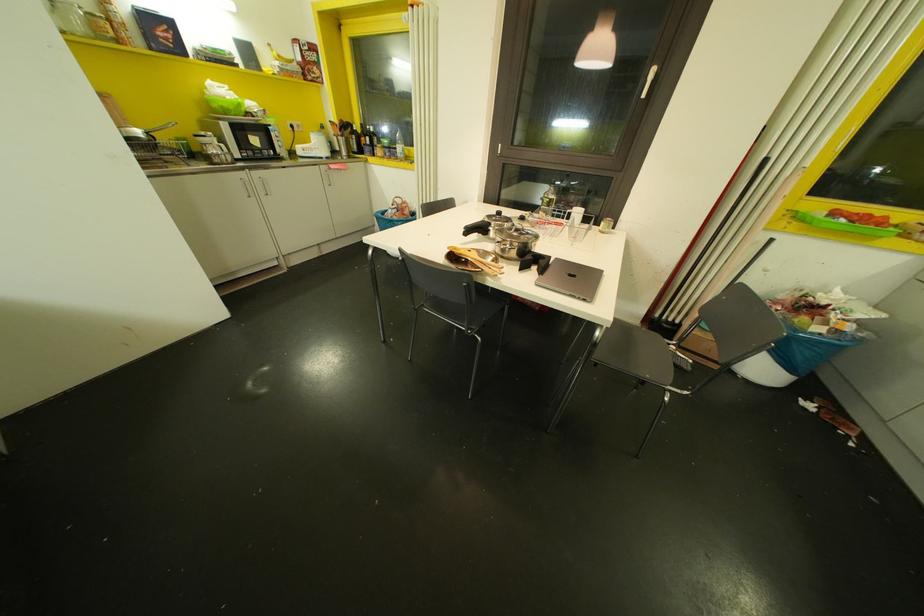
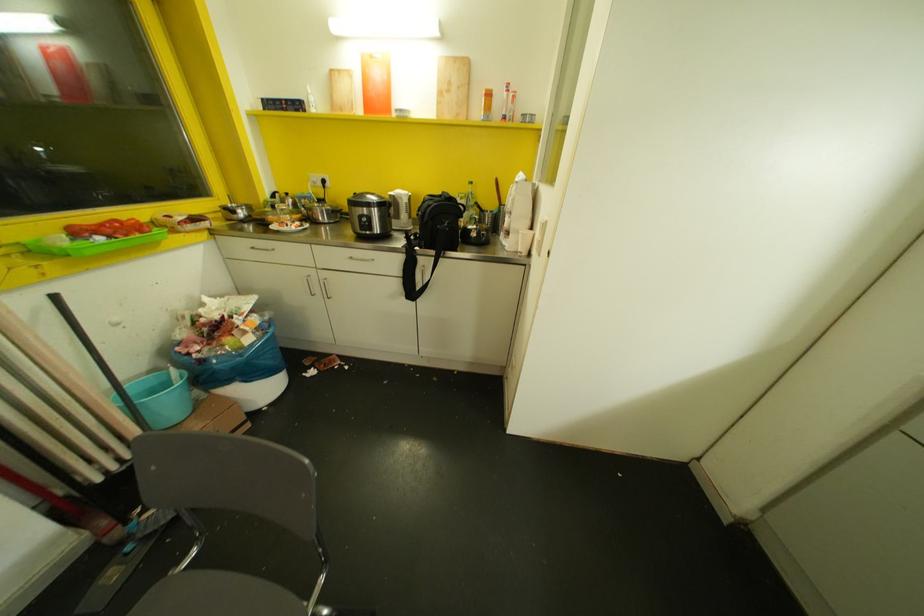
In the second image, find the point that corresponds to point 771,240 in the first image.

(55, 296)